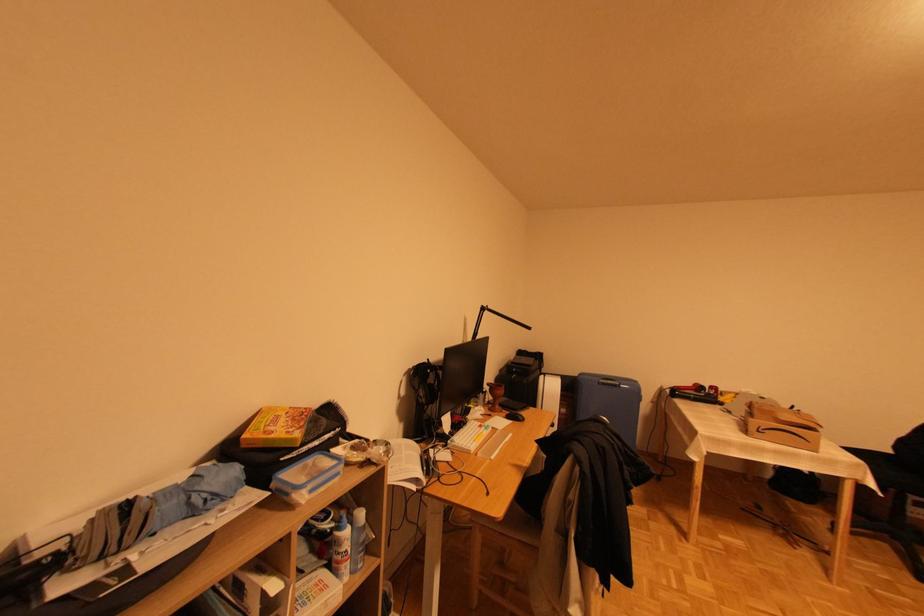
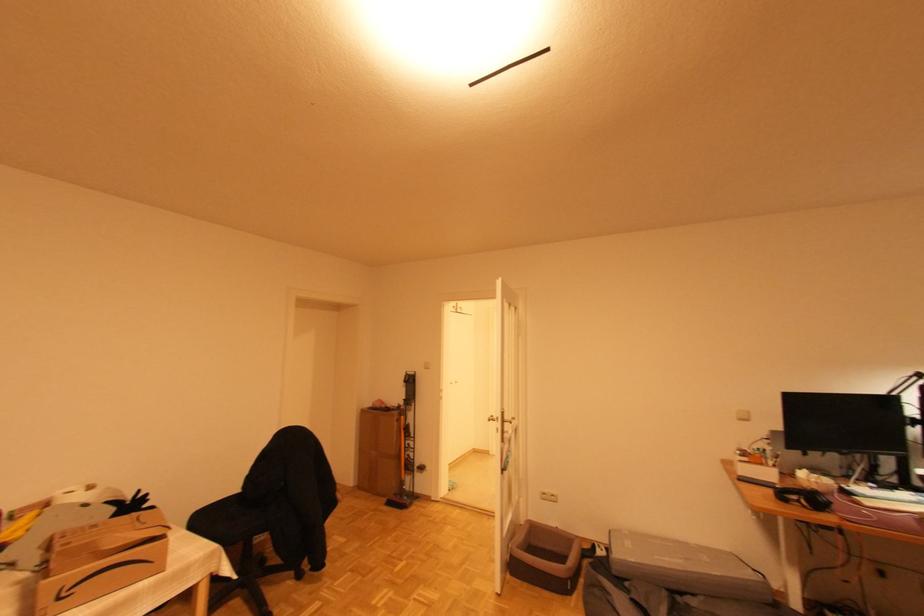
The point at (891, 451) is marked in the first image. Where is the corresponding point in the second image?

(239, 493)